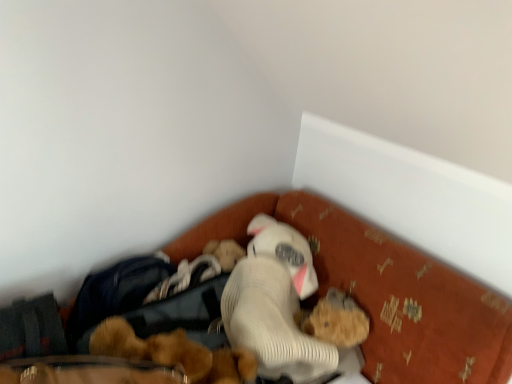
In order to click on free location above fluffy brown teddy bear at center, positioned as the 1th toy in left-to-right order (from a real-world perspective) in this screenshot , I will do `click(164, 325)`.